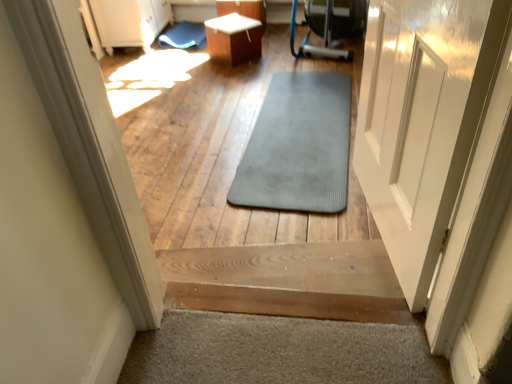
Where is `vacant area situated to the left side of white glossy table at center`? This screenshot has width=512, height=384. vacant area situated to the left side of white glossy table at center is located at coordinates (197, 62).